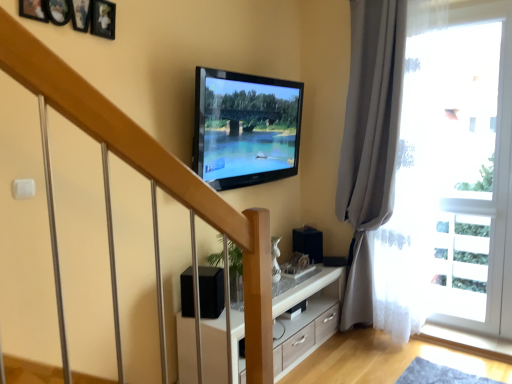
Question: Does flat screen tv at upper center have a lesser height compared to black matte speaker at lower center?

Choices:
 (A) no
 (B) yes

Answer: (A)

Question: Is flat screen tv at upper center not near black matte speaker at lower center?

Choices:
 (A) yes
 (B) no

Answer: (B)

Question: Is flat screen tv at upper center oriented away from black matte speaker at lower center?

Choices:
 (A) no
 (B) yes

Answer: (A)

Question: Can you confirm if flat screen tv at upper center is positioned to the right of black matte speaker at lower center?

Choices:
 (A) yes
 (B) no

Answer: (A)

Question: Can we say flat screen tv at upper center lies outside black matte speaker at lower center?

Choices:
 (A) no
 (B) yes

Answer: (B)

Question: Is flat screen tv at upper center smaller than black matte speaker at lower center?

Choices:
 (A) no
 (B) yes

Answer: (A)

Question: Does gray fabric curtain at right contain transparent glass door at right?

Choices:
 (A) no
 (B) yes

Answer: (A)

Question: Is gray fabric curtain at right looking in the opposite direction of transparent glass door at right?

Choices:
 (A) yes
 (B) no

Answer: (B)

Question: Is gray fabric curtain at right smaller than transparent glass door at right?

Choices:
 (A) yes
 (B) no

Answer: (B)

Question: From a real-world perspective, is gray fabric curtain at right below transparent glass door at right?

Choices:
 (A) yes
 (B) no

Answer: (B)

Question: Is gray fabric curtain at right further to camera compared to transparent glass door at right?

Choices:
 (A) yes
 (B) no

Answer: (B)

Question: Is gray fabric curtain at right aimed at transparent glass door at right?

Choices:
 (A) no
 (B) yes

Answer: (A)

Question: Is transparent glass door at right positioned behind white wood cabinet at center?

Choices:
 (A) yes
 (B) no

Answer: (A)